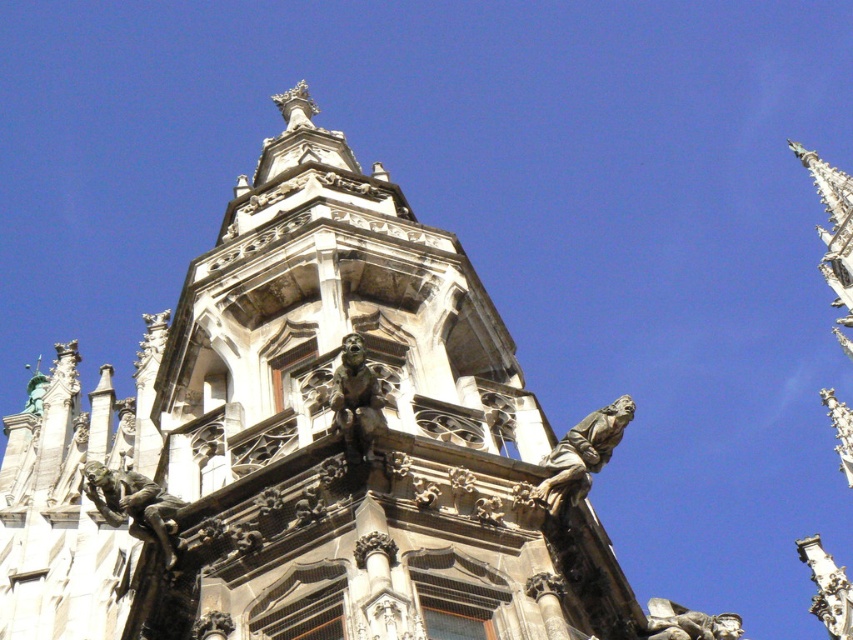
Describe the element at coordinates (582, 454) in the screenshot. I see `dark gray stone gargoyle at upper right` at that location.

You are a GUI agent. You are given a task and a screenshot of the screen. Output one action in this format:
    pyautogui.click(x=<x>, y=<y>)
    Task: Click on the dark gray stone gargoyle at upper right
    This screenshot has height=640, width=853.
    Given the screenshot: What is the action you would take?
    pyautogui.click(x=582, y=454)

Locate an element on the screen. dark gray stone gargoyle at upper right is located at coordinates (582, 454).

The width and height of the screenshot is (853, 640). What do you see at coordinates (357, 401) in the screenshot?
I see `polished bronze gargoyle at center` at bounding box center [357, 401].

Who is more forward, (358, 403) or (830, 419)?

Point (358, 403) is in front.

Identify the location of polished bronze gargoyle at center. (357, 401).

Between polished bronze gargoyle at lower left and polished stone gargoyle at upper right, which one has less height?

polished bronze gargoyle at lower left

Image resolution: width=853 pixels, height=640 pixels. What do you see at coordinates (132, 502) in the screenshot?
I see `polished bronze gargoyle at lower left` at bounding box center [132, 502].

Where is `polished bronze gargoyle at lower left`? This screenshot has height=640, width=853. polished bronze gargoyle at lower left is located at coordinates (132, 502).